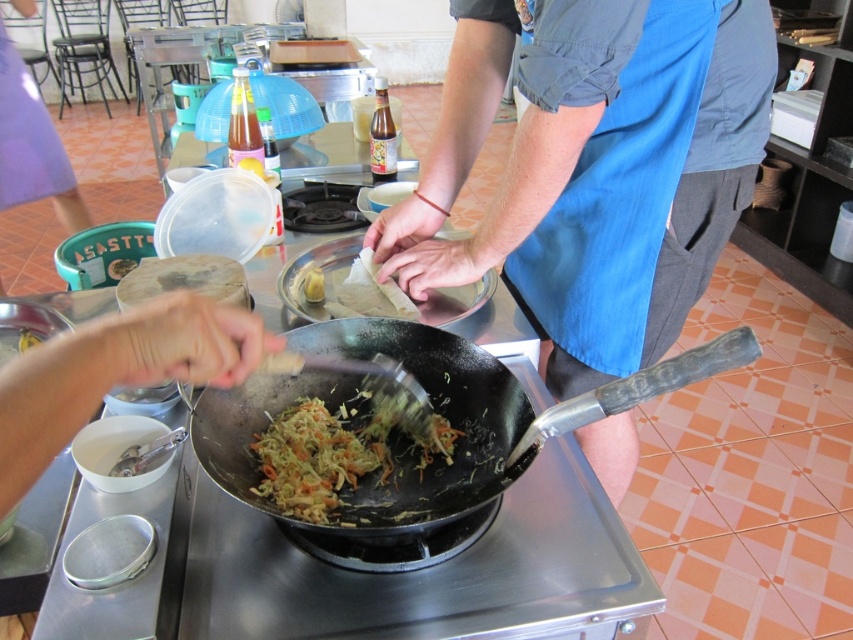
Question: Which of these objects is positioned closest to the shiny brown noodles at center?

Choices:
 (A) blue fabric apron at center
 (B) smooth silver spoon at lower left
 (C) black non-stick frying pan at center

Answer: (C)

Question: Estimate the real-world distances between objects in this image. Which object is farther from the smooth silver spoon at lower left?

Choices:
 (A) blue fabric apron at center
 (B) black non-stick frying pan at center

Answer: (A)

Question: Can you confirm if black non-stick frying pan at center is smaller than shiny brown noodles at center?

Choices:
 (A) yes
 (B) no

Answer: (B)

Question: Does blue fabric apron at center appear over smooth silver spoon at lower left?

Choices:
 (A) yes
 (B) no

Answer: (A)

Question: Which object appears farthest from the camera in this image?

Choices:
 (A) black non-stick frying pan at center
 (B) blue fabric apron at center
 (C) shiny brown noodles at center

Answer: (C)

Question: Can you confirm if black non-stick frying pan at center is bigger than shiny brown noodles at center?

Choices:
 (A) yes
 (B) no

Answer: (A)